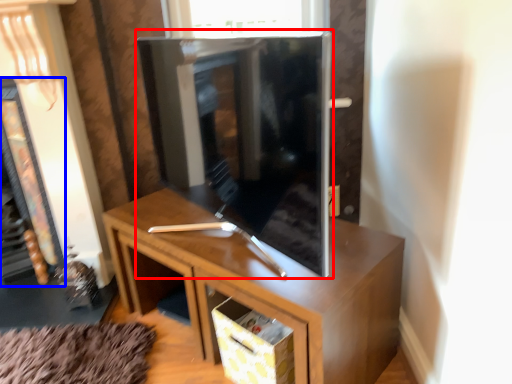
Question: Which point is closer to the camera, tv cabinet (highlighted by a red box) or fireplace (highlighted by a blue box)?

Choices:
 (A) tv cabinet
 (B) fireplace

Answer: (A)